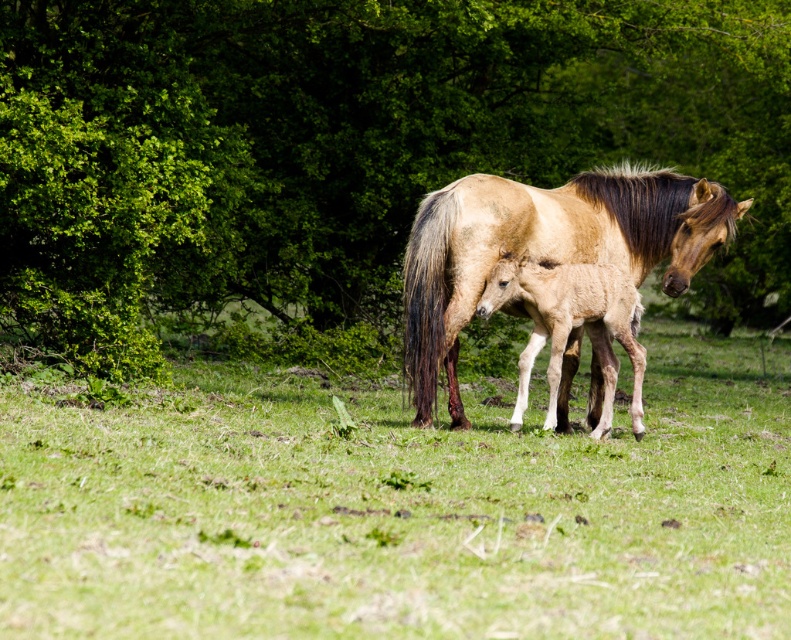
You are a bird looking for a place to land. You see the green leafy tree at center and the green grassy at center. Which one is above the other?

The green leafy tree at center is positioned over the green grassy at center, so the tree is above the grass.

You are a photographer trying to capture the entire scene of the green grassy at center and the light brown glossy horse at center in one shot. Based on the scene description, which object is wider so that you can adjust your camera angle accordingly?

The green grassy at center is wider than the light brown glossy horse at center, so you should adjust your camera angle to focus more on the wider area to include both objects properly.